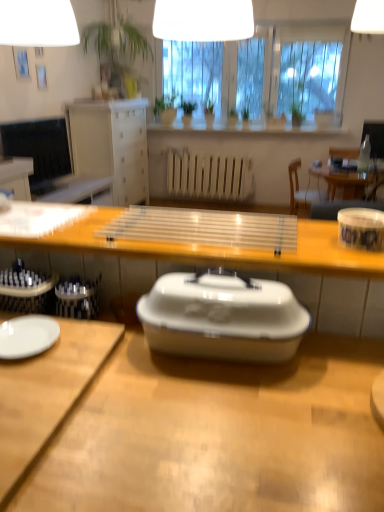
Question: Does green matte plant at center, which is the 4th houseplant from right to left, have a greater width compared to green leafy plant at center, arranged as the 1th houseplant when viewed from the right?

Choices:
 (A) yes
 (B) no

Answer: (A)

Question: Does green matte plant at center, which is the 4th houseplant from right to left, appear on the right side of green leafy plant at center, which ranks as the 5th houseplant in left-to-right order?

Choices:
 (A) yes
 (B) no

Answer: (B)

Question: Considering the relative sizes of green matte plant at center, acting as the 2th houseplant starting from the left, and green leafy plant at center, arranged as the 1th houseplant when viewed from the right, in the image provided, is green matte plant at center, acting as the 2th houseplant starting from the left, thinner than green leafy plant at center, arranged as the 1th houseplant when viewed from the right,?

Choices:
 (A) yes
 (B) no

Answer: (B)

Question: From a real-world perspective, is green matte plant at center, acting as the 2th houseplant starting from the left, located beneath green leafy plant at center, arranged as the 1th houseplant when viewed from the right?

Choices:
 (A) yes
 (B) no

Answer: (B)

Question: Considering the relative positions of green matte plant at center, which is the 4th houseplant from right to left, and green leafy plant at center, which ranks as the 5th houseplant in left-to-right order, in the image provided, is green matte plant at center, which is the 4th houseplant from right to left, to the left of green leafy plant at center, which ranks as the 5th houseplant in left-to-right order, from the viewer's perspective?

Choices:
 (A) yes
 (B) no

Answer: (A)

Question: Is matte white vase at upper center wider or thinner than green leafy plant at center, which ranks as the 5th houseplant in left-to-right order?

Choices:
 (A) thin
 (B) wide

Answer: (B)

Question: From the image's perspective, relative to green leafy plant at center, which ranks as the 5th houseplant in left-to-right order, is matte white vase at upper center above or below?

Choices:
 (A) below
 (B) above

Answer: (B)

Question: From a real-world perspective, is matte white vase at upper center above or below green leafy plant at center, which ranks as the 5th houseplant in left-to-right order?

Choices:
 (A) above
 (B) below

Answer: (A)

Question: Considering the positions of matte white vase at upper center and green leafy plant at center, which ranks as the 5th houseplant in left-to-right order, in the image, is matte white vase at upper center taller or shorter than green leafy plant at center, which ranks as the 5th houseplant in left-to-right order,?

Choices:
 (A) short
 (B) tall

Answer: (B)

Question: Considering the positions of point (183, 39) and point (195, 101), is point (183, 39) closer or farther from the camera than point (195, 101)?

Choices:
 (A) farther
 (B) closer

Answer: (B)

Question: Which is correct: white glossy lampshade at upper center is inside green glossy houseplant at center, which appears as the third houseplant when viewed from the right, or outside of it?

Choices:
 (A) outside
 (B) inside

Answer: (A)

Question: Relative to green glossy houseplant at center, the third houseplant viewed from the left, is white glossy lampshade at upper center in front or behind?

Choices:
 (A) behind
 (B) front

Answer: (B)

Question: From a real-world perspective, is white glossy lampshade at upper center above or below green glossy houseplant at center, which appears as the third houseplant when viewed from the right?

Choices:
 (A) above
 (B) below

Answer: (A)

Question: From the image's perspective, is matte white vase at upper center located above or below transparent plastic tray at center, placed as the 3th desk when sorted from bottom to top?

Choices:
 (A) below
 (B) above

Answer: (B)

Question: From a real-world perspective, is matte white vase at upper center positioned above or below transparent plastic tray at center, the first desk from the top?

Choices:
 (A) above
 (B) below

Answer: (A)